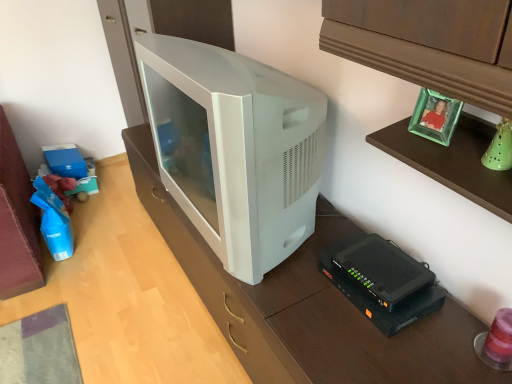
What are the coordinates of `vacant space situated above black plastic router at lower right (from a real-world perspective)` in the screenshot? It's located at (379, 261).